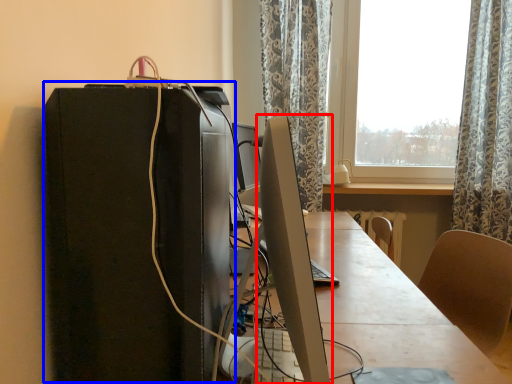
Question: Which of the following is the closest to the observer, computer monitor (highlighted by a red box) or computer tower (highlighted by a blue box)?

Choices:
 (A) computer monitor
 (B) computer tower

Answer: (A)